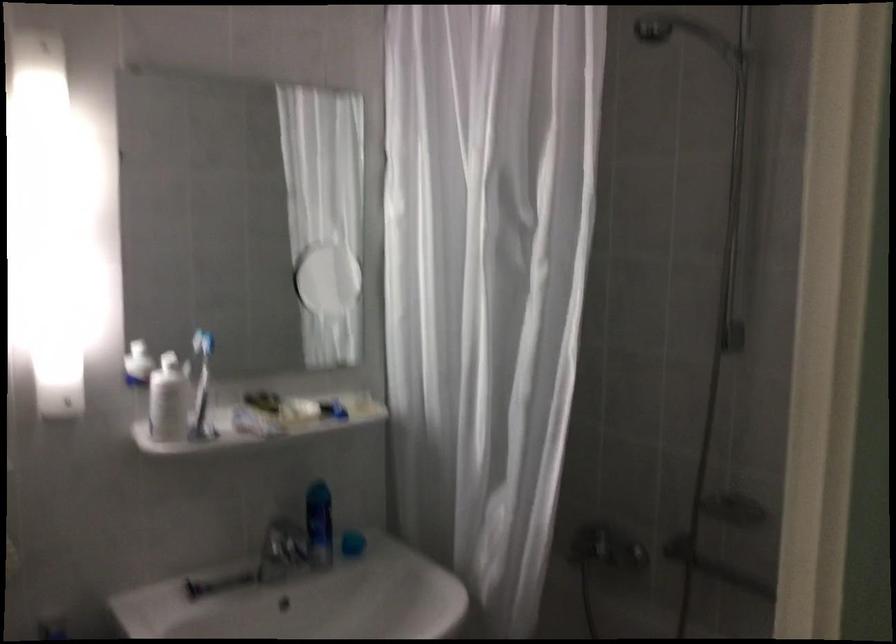
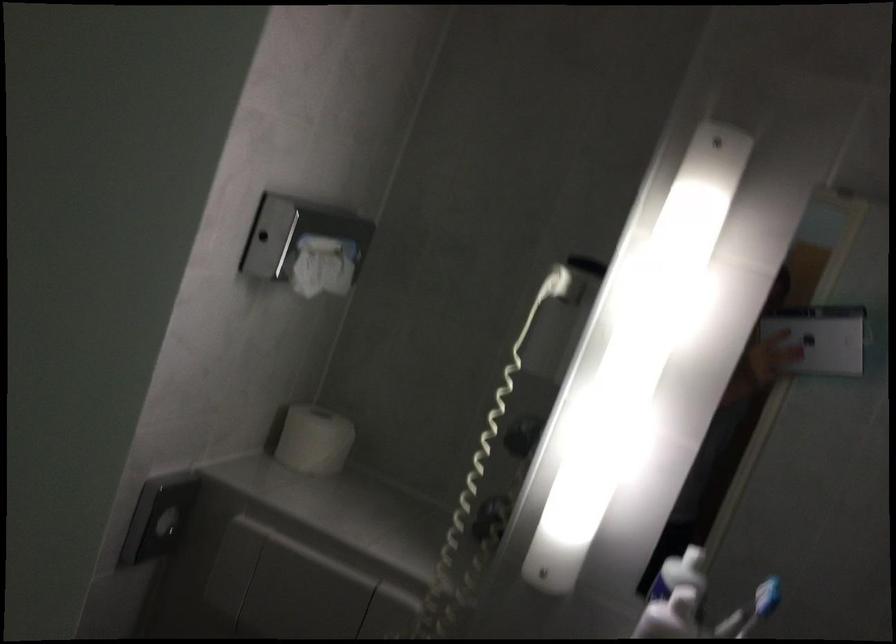
Question: The images are taken continuously from a first-person perspective. In which direction is your viewpoint rotating?

Choices:
 (A) Left
 (B) Right
 (C) Up
 (D) Down

Answer: (A)